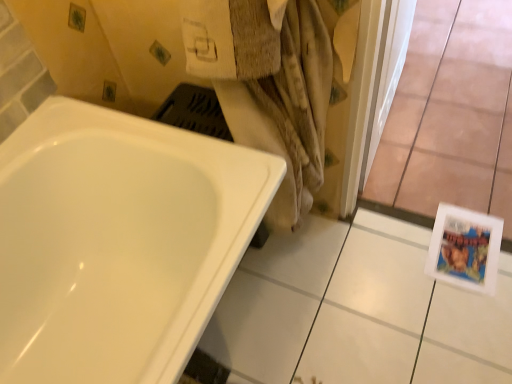
Question: Considering the relative positions of transparent glass door at lower right and beige textured towel at center in the image provided, is transparent glass door at lower right to the right of beige textured towel at center from the viewer's perspective?

Choices:
 (A) no
 (B) yes

Answer: (B)

Question: Is transparent glass door at lower right touching beige textured towel at center?

Choices:
 (A) yes
 (B) no

Answer: (B)

Question: Is transparent glass door at lower right bigger than beige textured towel at center?

Choices:
 (A) no
 (B) yes

Answer: (A)

Question: Does transparent glass door at lower right have a greater height compared to beige textured towel at center?

Choices:
 (A) yes
 (B) no

Answer: (B)

Question: Does transparent glass door at lower right have a greater width compared to beige textured towel at center?

Choices:
 (A) yes
 (B) no

Answer: (A)

Question: Would you say beige textured towel at center is inside or outside white glossy bathtub at lower left?

Choices:
 (A) outside
 (B) inside

Answer: (A)

Question: In terms of size, does beige textured towel at center appear bigger or smaller than white glossy bathtub at lower left?

Choices:
 (A) small
 (B) big

Answer: (A)

Question: From a real-world perspective, is beige textured towel at center positioned above or below white glossy bathtub at lower left?

Choices:
 (A) below
 (B) above

Answer: (B)

Question: From the image's perspective, is beige textured towel at center above or below white glossy bathtub at lower left?

Choices:
 (A) above
 (B) below

Answer: (A)

Question: Is point (119, 223) closer or farther from the camera than point (272, 379)?

Choices:
 (A) farther
 (B) closer

Answer: (B)

Question: Considering their positions, is white glossy bathtub at lower left located in front of or behind white glossy tile at lower right?

Choices:
 (A) behind
 (B) front

Answer: (B)

Question: Is white glossy bathtub at lower left bigger or smaller than white glossy tile at lower right?

Choices:
 (A) big
 (B) small

Answer: (A)

Question: Is white glossy bathtub at lower left inside or outside of white glossy tile at lower right?

Choices:
 (A) outside
 (B) inside

Answer: (A)

Question: Based on their sizes in the image, would you say white glossy bathtub at lower left is bigger or smaller than transparent glass door at lower right?

Choices:
 (A) small
 (B) big

Answer: (B)

Question: Would you say white glossy bathtub at lower left is to the left or to the right of transparent glass door at lower right in the picture?

Choices:
 (A) left
 (B) right

Answer: (A)